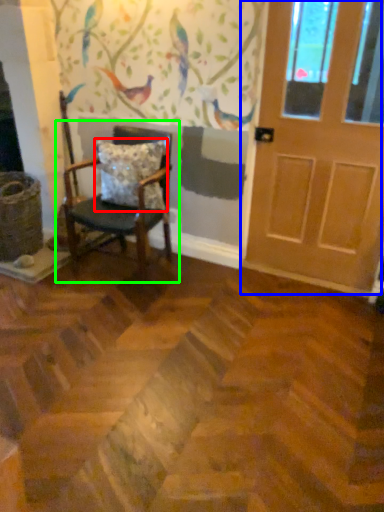
Question: Estimate the real-world distances between objects in this image. Which object is closer to pillow (highlighted by a red box), door (highlighted by a blue box) or chair (highlighted by a green box)?

Choices:
 (A) door
 (B) chair

Answer: (B)